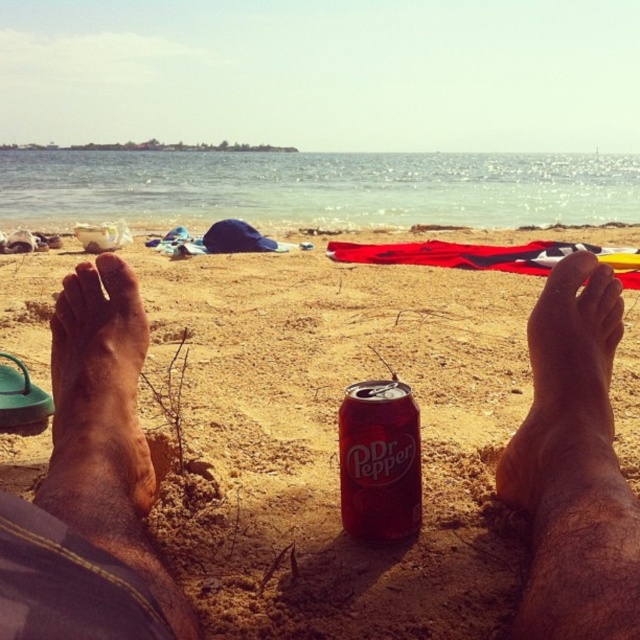
You are a beachgoer who wants to place your dry skin foot at lower right onto the smooth sand at feet center. Is there enough space for your foot to fit without overlapping the sand?

The smooth sand at feet center might be wider than dry skin foot at lower right, so there is likely enough space for the foot to fit without overlapping the sand.

You are a photographer trying to capture the contrast between the dry skin foot at lower right and the brown skin at center. Which part of the foot is narrower?

The dry skin foot at lower right is thinner than the brown skin at center, so the dry skin foot at lower right is narrower.

You are lying on the beach and want to reach two points marked on the sand. One is at point (612,348) and the other at point (92,417). Which point is closer to your feet?

Point (92,417) is closer to your feet because it is in front of point (612,348).